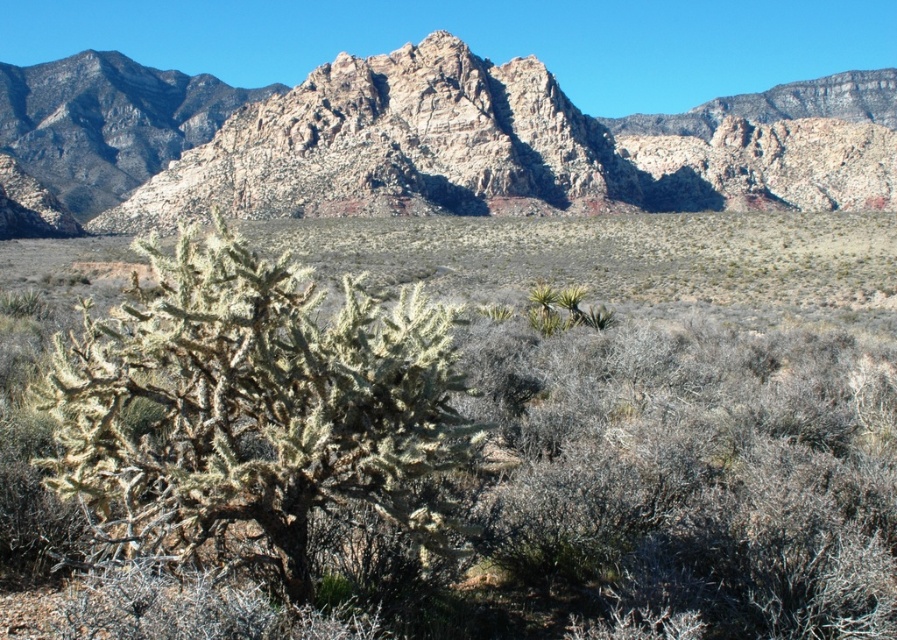
In order to click on rugged rock mountain range at upper center in this screenshot , I will do `click(417, 140)`.

Is point (315, 192) farther from camera compared to point (198, 289)?

Yes, it is behind point (198, 289).

Is point (684, 129) farther from viewer compared to point (196, 456)?

Yes, point (684, 129) is behind point (196, 456).

Identify the location of rugged rock mountain range at upper center. The image size is (897, 640). [417, 140].